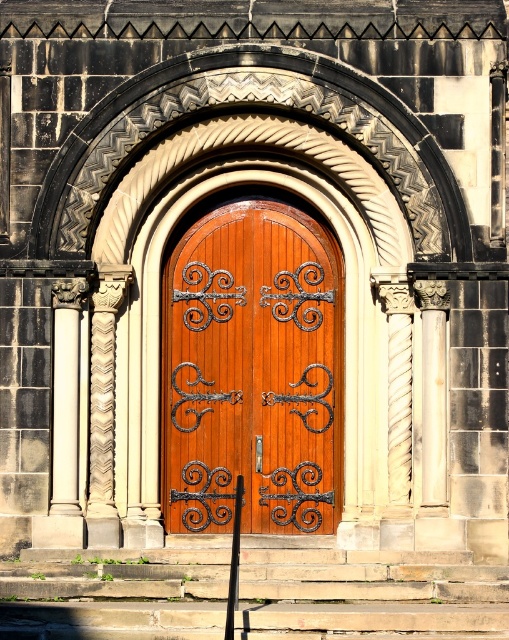
Question: Does polished wood door at center have a lesser width compared to carved stone column at left?

Choices:
 (A) no
 (B) yes

Answer: (A)

Question: Does polished wood door at center come in front of carved stone column at left?

Choices:
 (A) no
 (B) yes

Answer: (A)

Question: Which of the following is the closest to the observer?

Choices:
 (A) carved stone column at left
 (B) polished wood door at center

Answer: (A)

Question: Which object appears closest to the camera in this image?

Choices:
 (A) polished wood door at center
 (B) carved stone column at left

Answer: (B)

Question: From the image, what is the correct spatial relationship of polished wood door at center in relation to carved stone column at left?

Choices:
 (A) above
 (B) below

Answer: (A)